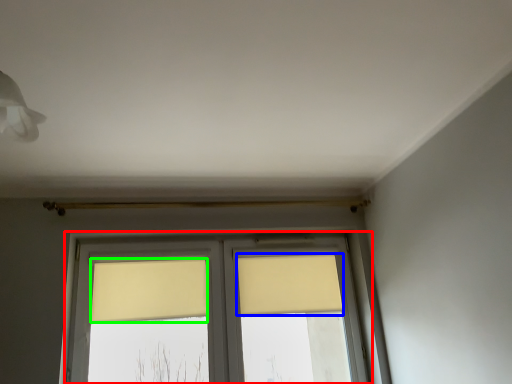
Question: Based on their relative distances, which object is nearer to window (highlighted by a red box)? Choose from curtain (highlighted by a blue box) and curtain (highlighted by a green box).

Choices:
 (A) curtain
 (B) curtain

Answer: (A)